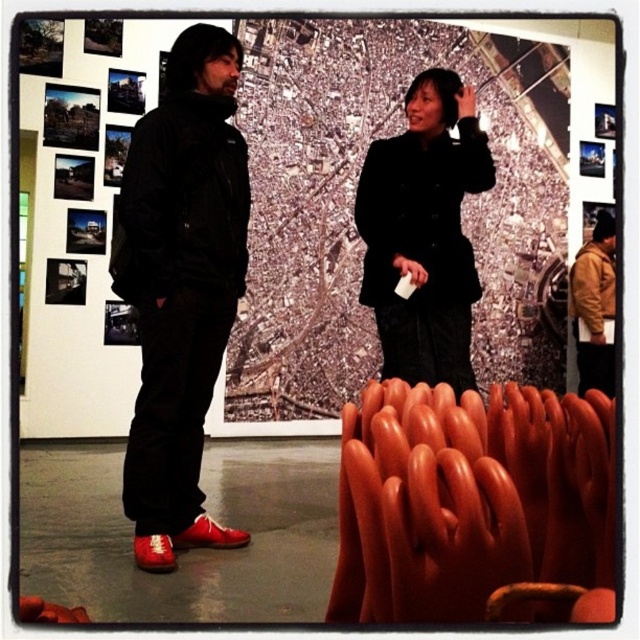
This screenshot has width=640, height=640. Describe the element at coordinates (180, 269) in the screenshot. I see `matte black jacket at left` at that location.

Is matte black jacket at left wider than shiny red shoe at lower left?

Yes.

In order to click on matte black jacket at left in this screenshot , I will do `click(180, 269)`.

Is point (154, 403) more distant than point (596, 273)?

No, it is not.

Locate an element on the screen. matte black jacket at left is located at coordinates (180, 269).

Who is more forward, (424, 339) or (600, 280)?

Positioned in front is point (424, 339).

Does matte black coat at center appear on the left side of brown leather jacket at right?

Correct, you'll find matte black coat at center to the left of brown leather jacket at right.

Measure the distance between matte black coat at center and camera.

The distance of matte black coat at center from camera is 7.04 feet.

The height and width of the screenshot is (640, 640). Identify the location of matte black coat at center. (422, 232).